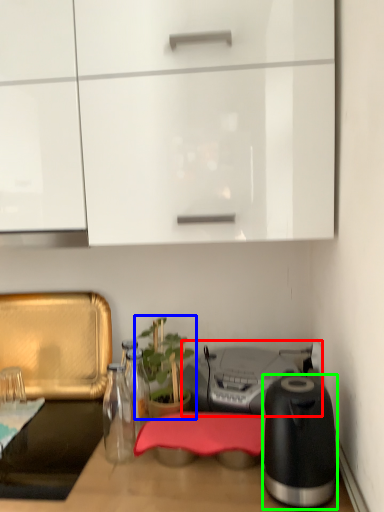
Question: Estimate the real-world distances between objects in this image. Which object is farther from appliance (highlighted by a red box), houseplant (highlighted by a blue box) or kitchen appliance (highlighted by a green box)?

Choices:
 (A) houseplant
 (B) kitchen appliance

Answer: (B)